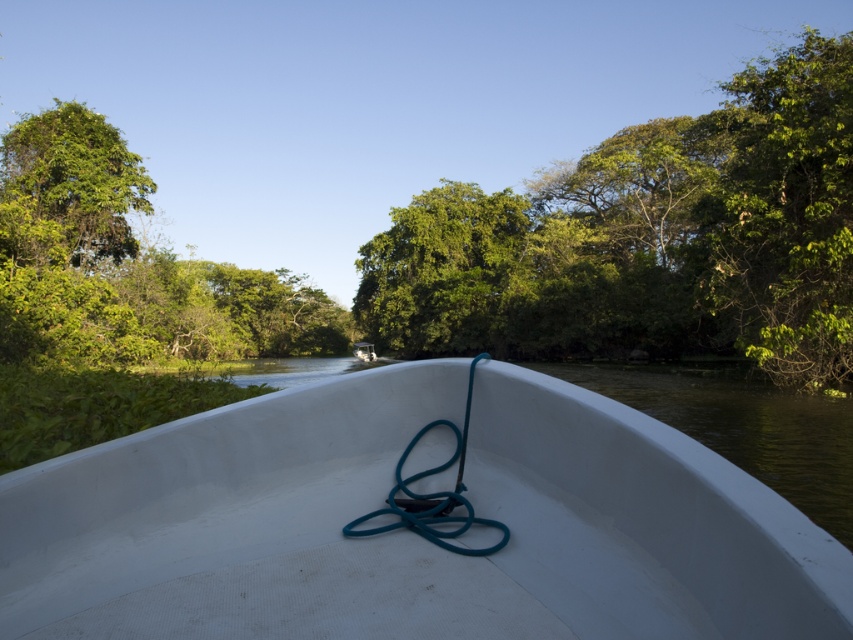
Between green leafy tree at upper left and teal rubber rope at center, which one has more height?

green leafy tree at upper left is taller.

Which is in front, point (84, 161) or point (480, 522)?

Point (480, 522) is in front.

Where is `green leafy tree at upper left`? The image size is (853, 640). green leafy tree at upper left is located at coordinates (77, 177).

Between point (485, 390) and point (361, 346), which one is positioned behind?

The point (361, 346) is more distant.

Image resolution: width=853 pixels, height=640 pixels. I want to click on white plastic boat at center, so click(x=409, y=531).

Between point (453, 214) and point (779, 262), which one is positioned in front?

Point (779, 262) is more forward.

Can you confirm if green leafy trees at center is wider than green leafy tree at right?

Yes.

In order to click on green leafy trees at center in this screenshot , I will do `click(648, 237)`.